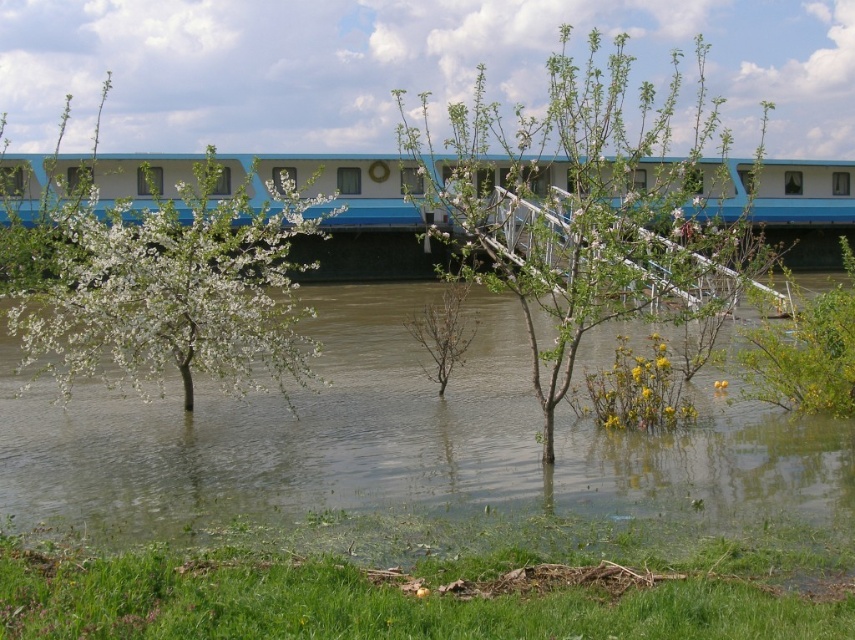
Looking at this image, you are a drone operator trying to locate a specific tree in the flooded area. The coordinates given are point (175, 291). According to the image, what object is located at this point?

The point (175, 291) corresponds to the white blossoming tree at center.

You are a surveyor trying to map the flooded area. You have a drone that can take photos from above. To ensure accuracy, you need to capture an image where the white blossoming tree at center is exactly at the center of the photo. Given the tree is currently at coordinate point 0.455, 0.207, what adjustment should you make to the drone to center the tree?

To center the white blossoming tree at center, the drone should adjust its position so that the tree moves from its current coordinates of 0.455 on the x axis and 0.207 on the y axis to the center point of the photo, which is typically at [427,320]. This means moving the drone slightly to the right along the x axis and upwards along the y axis to align the tree at the center coordinates.